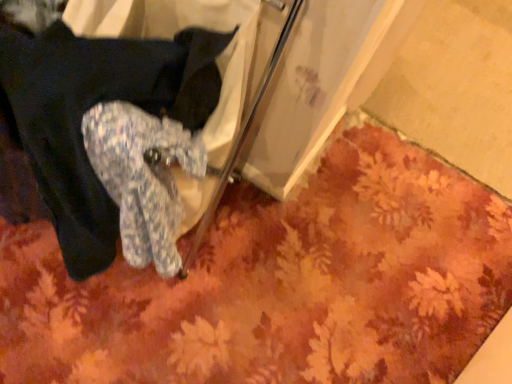
Describe the element at coordinates (91, 107) in the screenshot. I see `fluffy blue socks at lower left` at that location.

This screenshot has width=512, height=384. Identify the location of fluffy blue socks at lower left. (91, 107).

Find the location of a particular element. Image resolution: width=512 pixels, height=384 pixels. floral carpet at lower center is located at coordinates (281, 284).

Measure the distance between floral carpet at lower center and camera.

The distance of floral carpet at lower center from camera is 1.01 meters.

The width and height of the screenshot is (512, 384). What do you see at coordinates (281, 284) in the screenshot?
I see `floral carpet at lower center` at bounding box center [281, 284].

What are the coordinates of `fluffy blue socks at lower left` in the screenshot? It's located at (91, 107).

Is fluffy blue socks at lower left to the right of floral carpet at lower center from the viewer's perspective?

No.

Which object is more forward, fluffy blue socks at lower left or floral carpet at lower center?

Positioned in front is fluffy blue socks at lower left.

Considering the points (16, 40) and (310, 226), which point is behind, point (16, 40) or point (310, 226)?

Positioned behind is point (310, 226).

From the image's perspective, is fluffy blue socks at lower left on floral carpet at lower center?

Yes.

From a real-world perspective, relative to floral carpet at lower center, is fluffy blue socks at lower left vertically above or below?

fluffy blue socks at lower left is above floral carpet at lower center.

Is fluffy blue socks at lower left thinner than floral carpet at lower center?

Correct, the width of fluffy blue socks at lower left is less than that of floral carpet at lower center.

Can you confirm if fluffy blue socks at lower left is shorter than floral carpet at lower center?

No, fluffy blue socks at lower left is not shorter than floral carpet at lower center.

Which of these two, fluffy blue socks at lower left or floral carpet at lower center, is bigger?

Bigger between the two is fluffy blue socks at lower left.

Is fluffy blue socks at lower left positioned beyond the bounds of floral carpet at lower center?

fluffy blue socks at lower left is positioned outside floral carpet at lower center.

Are fluffy blue socks at lower left and floral carpet at lower center beside each other?

They are not placed beside each other.

Does fluffy blue socks at lower left turn towards floral carpet at lower center?

No, fluffy blue socks at lower left is not oriented towards floral carpet at lower center.

Can you tell me how much fluffy blue socks at lower left and floral carpet at lower center differ in facing direction?

The angular difference between fluffy blue socks at lower left and floral carpet at lower center is 178 degrees.

Where is `clothing on the left of floral carpet at lower center`? clothing on the left of floral carpet at lower center is located at coordinates (91, 107).

Is floral carpet at lower center to the left or to the right of fluffy blue socks at lower left in the image?

From the image, it's evident that floral carpet at lower center is to the right of fluffy blue socks at lower left.

Considering their positions, is floral carpet at lower center located in front of or behind fluffy blue socks at lower left?

floral carpet at lower center is behind fluffy blue socks at lower left.

Between point (217, 295) and point (9, 38), which one is positioned behind?

The point (217, 295) is farther from the camera.

From the image's perspective, is floral carpet at lower center above or below fluffy blue socks at lower left?

Based on their image positions, floral carpet at lower center is located beneath fluffy blue socks at lower left.

From a real-world perspective, between floral carpet at lower center and fluffy blue socks at lower left, who is vertically higher?

fluffy blue socks at lower left, from a real-world perspective.

Which object is thinner, floral carpet at lower center or fluffy blue socks at lower left?

With smaller width is fluffy blue socks at lower left.

Considering the sizes of objects floral carpet at lower center and fluffy blue socks at lower left in the image provided, who is shorter, floral carpet at lower center or fluffy blue socks at lower left?

Standing shorter between the two is floral carpet at lower center.

Considering the sizes of objects floral carpet at lower center and fluffy blue socks at lower left in the image provided, who is bigger, floral carpet at lower center or fluffy blue socks at lower left?

With larger size is fluffy blue socks at lower left.

Is floral carpet at lower center spatially inside fluffy blue socks at lower left, or outside of it?

floral carpet at lower center is not enclosed by fluffy blue socks at lower left.

Is floral carpet at lower center placed right next to fluffy blue socks at lower left?

No, floral carpet at lower center is not making contact with fluffy blue socks at lower left.

Is floral carpet at lower center aimed at fluffy blue socks at lower left?

No, floral carpet at lower center is not aimed at fluffy blue socks at lower left.

Where is `clothing on the left of floral carpet at lower center`? The image size is (512, 384). clothing on the left of floral carpet at lower center is located at coordinates (91, 107).

Where is `mat that is behind the fluffy blue socks at lower left`? mat that is behind the fluffy blue socks at lower left is located at coordinates (281, 284).

Locate an element on the screen. clothing above the floral carpet at lower center (from the image's perspective) is located at coordinates (91, 107).